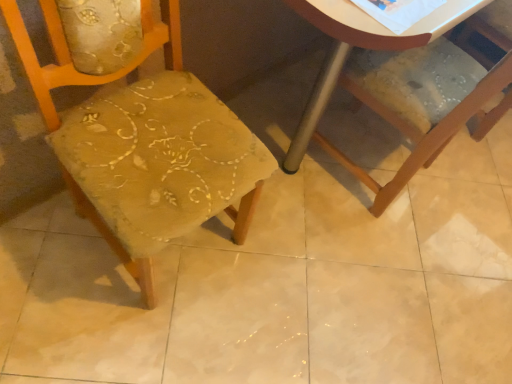
The height and width of the screenshot is (384, 512). In order to click on vacant region to the right of textured fabric chair at center, positioned as the first chair in left-to-right order in this screenshot , I will do `click(279, 289)`.